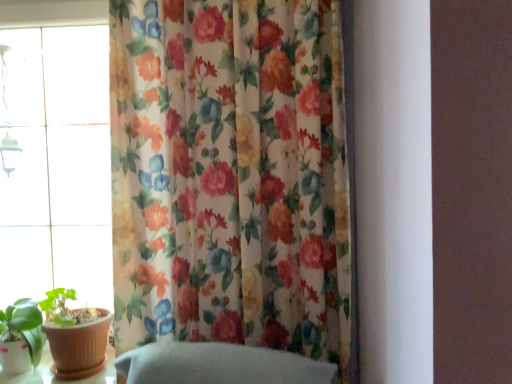
Question: From a real-world perspective, is transparent glass window at left on top of floral fabric curtain at center?

Choices:
 (A) no
 (B) yes

Answer: (B)

Question: Can you confirm if transparent glass window at left is wider than floral fabric curtain at center?

Choices:
 (A) no
 (B) yes

Answer: (A)

Question: Does transparent glass window at left have a lesser height compared to floral fabric curtain at center?

Choices:
 (A) yes
 (B) no

Answer: (B)

Question: Is transparent glass window at left in front of floral fabric curtain at center?

Choices:
 (A) yes
 (B) no

Answer: (B)

Question: Is transparent glass window at left smaller than floral fabric curtain at center?

Choices:
 (A) no
 (B) yes

Answer: (B)

Question: In terms of size, does transparent glass window at left appear bigger or smaller than floral fabric curtain at center?

Choices:
 (A) big
 (B) small

Answer: (B)

Question: From their relative heights in the image, would you say transparent glass window at left is taller or shorter than floral fabric curtain at center?

Choices:
 (A) short
 (B) tall

Answer: (B)

Question: From a real-world perspective, is transparent glass window at left above or below floral fabric curtain at center?

Choices:
 (A) below
 (B) above

Answer: (B)

Question: Is point (62, 46) closer or farther from the camera than point (256, 170)?

Choices:
 (A) farther
 (B) closer

Answer: (A)

Question: Relative to green matte leaf at lower left, is transparent glass window at left in front or behind?

Choices:
 (A) front
 (B) behind

Answer: (B)

Question: Based on their sizes in the image, would you say transparent glass window at left is bigger or smaller than green matte leaf at lower left?

Choices:
 (A) small
 (B) big

Answer: (B)

Question: Is transparent glass window at left taller or shorter than green matte leaf at lower left?

Choices:
 (A) short
 (B) tall

Answer: (B)

Question: Visually, is transparent glass window at left positioned to the left or to the right of green matte leaf at lower left?

Choices:
 (A) left
 (B) right

Answer: (B)

Question: In the image, is floral fabric curtain at center positioned in front of or behind green matte leaf at lower left?

Choices:
 (A) front
 (B) behind

Answer: (A)

Question: Is floral fabric curtain at center taller or shorter than green matte leaf at lower left?

Choices:
 (A) short
 (B) tall

Answer: (B)